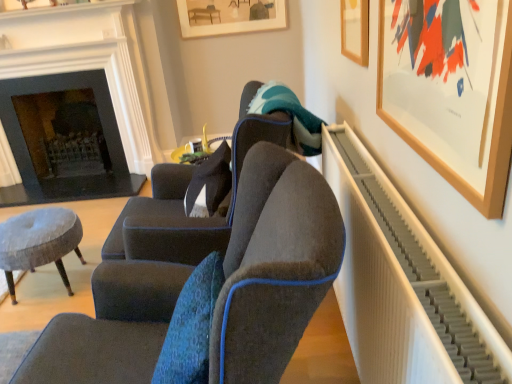
Where is `free space above velvet grey stool at lower left (from a real-world perspective)`? The image size is (512, 384). free space above velvet grey stool at lower left (from a real-world perspective) is located at coordinates coord(23,228).